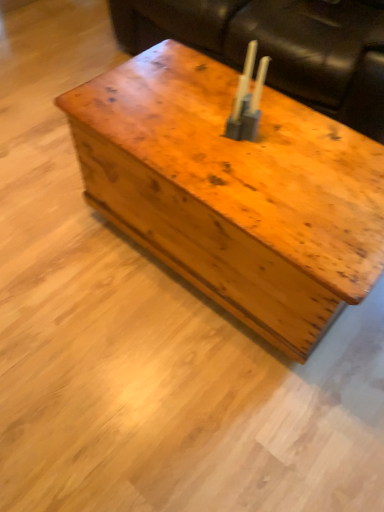
Question: Considering the positions of metallic silver candle holder at center and wooden trunk at center in the image, is metallic silver candle holder at center bigger or smaller than wooden trunk at center?

Choices:
 (A) big
 (B) small

Answer: (B)

Question: In the image, is metallic silver candle holder at center positioned in front of or behind wooden trunk at center?

Choices:
 (A) front
 (B) behind

Answer: (B)

Question: Which is nearer to the metallic silver candle holder at center?

Choices:
 (A) wooden trunk at center
 (B) leather couch at upper center

Answer: (A)

Question: Based on their relative distances, which object is farther from the wooden trunk at center?

Choices:
 (A) metallic silver candle holder at center
 (B) leather couch at upper center

Answer: (B)